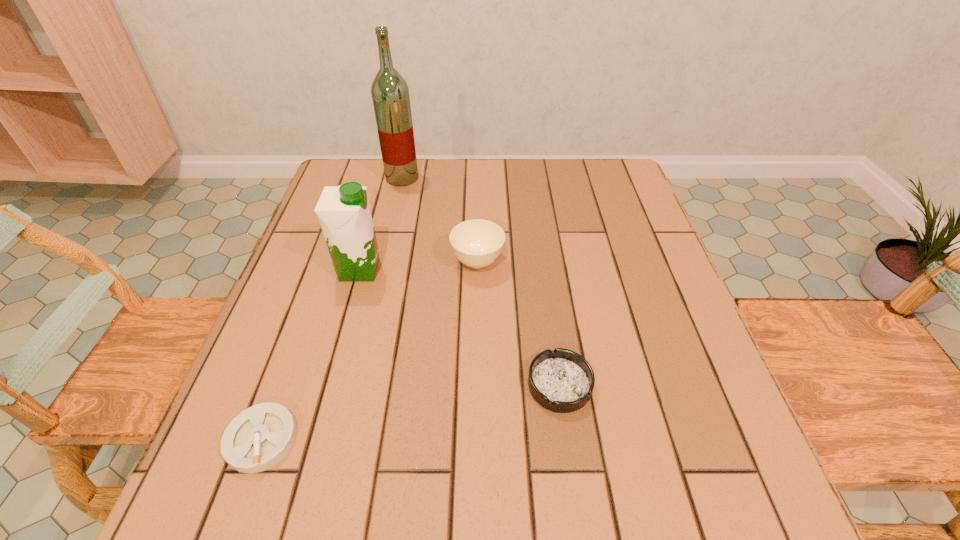
Identify the location of vacant position located on the right of the rightmost object. This screenshot has height=540, width=960. (686, 384).

The image size is (960, 540). In order to click on vacant region located on the right of the left ashtray in this screenshot , I will do `click(542, 439)`.

This screenshot has width=960, height=540. Identify the location of object that is positioned at the far edge. (390, 93).

Identify the location of object that is positioned at the near edge. (258, 438).

At what (x,y) coordinates should I click in order to perform the action: click on liquor that is positioned at the left edge. Please return your answer as a coordinate pair (x, y). This screenshot has width=960, height=540. Looking at the image, I should click on (390, 93).

The image size is (960, 540). Identify the location of soya milk that is at the left edge. (344, 213).

Find the location of `ashtray at the left edge`. ashtray at the left edge is located at coordinates coord(258,438).

You are a GUI agent. You are given a task and a screenshot of the screen. Output one action in this format:
    pyautogui.click(x=<x>, y=<y>)
    Task: Click on the object at the far left corner
    
    Given the screenshot: What is the action you would take?
    pyautogui.click(x=390, y=93)

Find the location of a particular element. object present at the near left corner is located at coordinates (258, 438).

Locate an element on the screen. blank space at the far edge of the desktop is located at coordinates (515, 176).